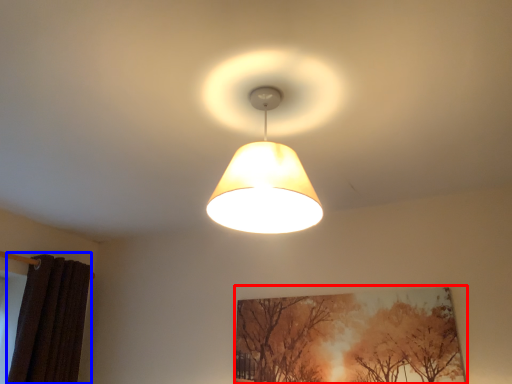
Question: Which of the following is the closest to the observer, picture frame (highlighted by a red box) or curtain (highlighted by a blue box)?

Choices:
 (A) picture frame
 (B) curtain

Answer: (A)